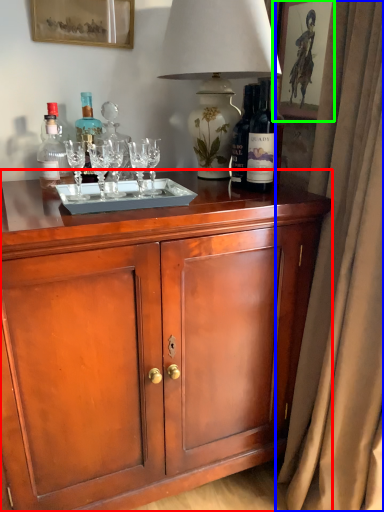
Question: Estimate the real-world distances between objects in this image. Which object is farther from cabinetry (highlighted by a red box), curtain (highlighted by a blue box) or picture frame (highlighted by a green box)?

Choices:
 (A) curtain
 (B) picture frame

Answer: (B)